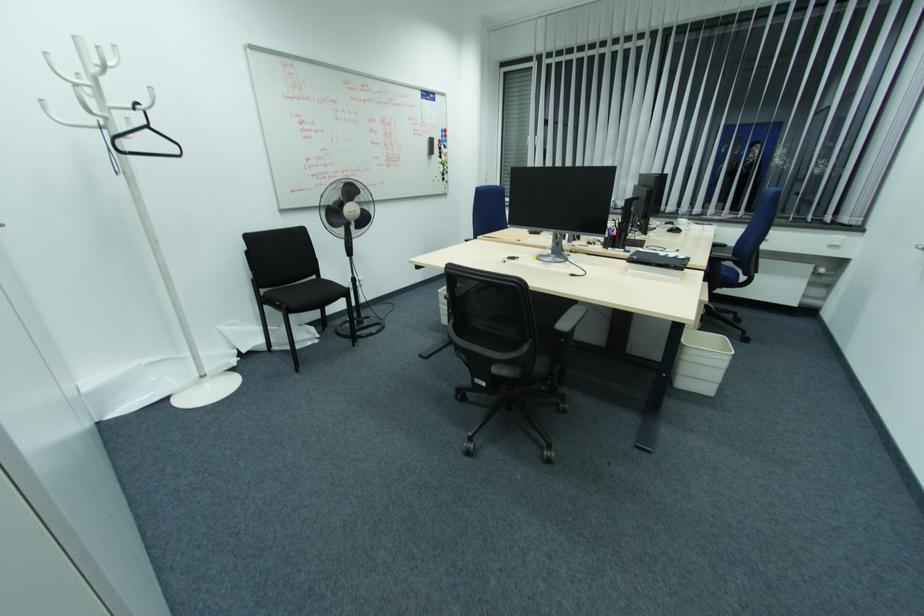
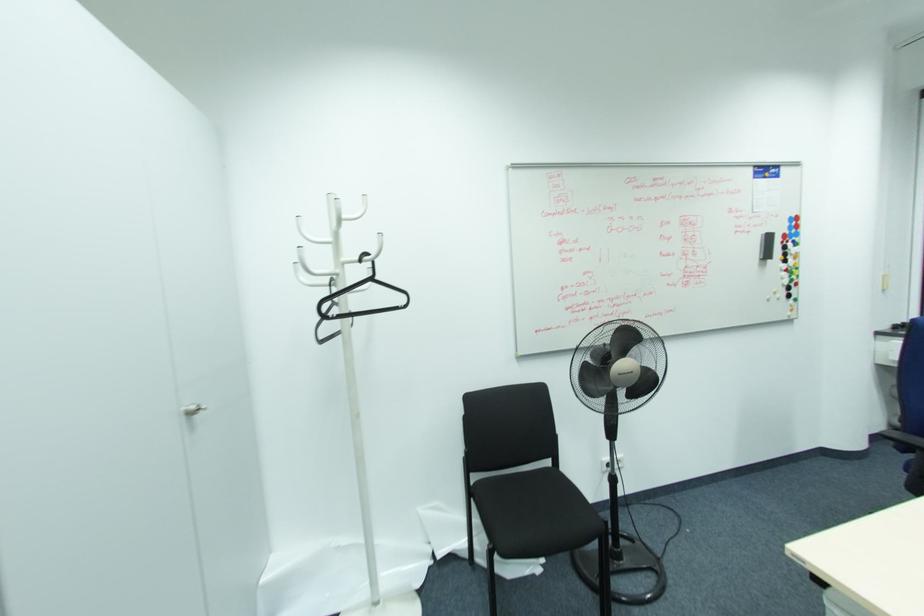
In the second image, find the point that corresponds to point 445,144 in the first image.

(796, 238)